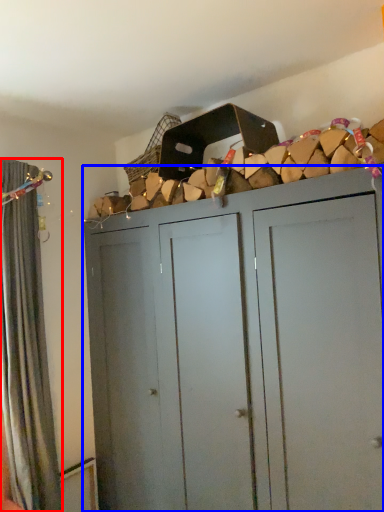
Question: Which point is further to the camera, curtain (highlighted by a red box) or cupboard (highlighted by a blue box)?

Choices:
 (A) curtain
 (B) cupboard

Answer: (A)